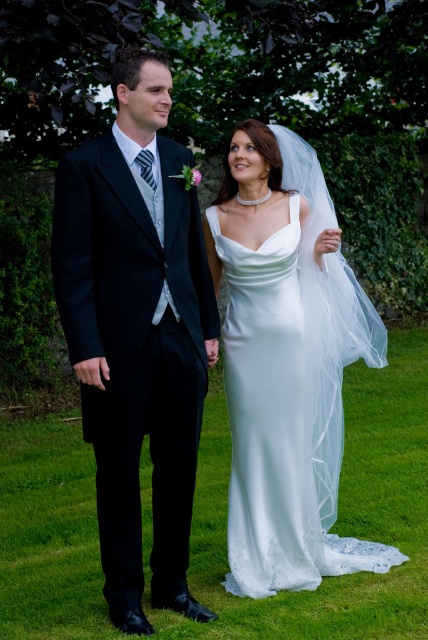
Based on the photo, who is taller, matte black suit at left or green grass at center?

Standing taller between the two is matte black suit at left.

Which is below, matte black suit at left or green grass at center?

green grass at center is below.

Does point (151, 385) lie in front of point (20, 506)?

Yes, it is in front of point (20, 506).

This screenshot has height=640, width=428. I want to click on matte black suit at left, so click(x=136, y=332).

Image resolution: width=428 pixels, height=640 pixels. I want to click on green grass at center, so click(x=225, y=524).

From the picture: Is green grass at center further to the viewer compared to white satin dress at center?

That is True.

Which is behind, point (229, 630) or point (240, 260)?

Positioned behind is point (240, 260).

At what (x,y) coordinates should I click in order to perform the action: click on green grass at center. Please return your answer as a coordinate pair (x, y). This screenshot has height=640, width=428. Looking at the image, I should click on (225, 524).

What do you see at coordinates (136, 332) in the screenshot? The width and height of the screenshot is (428, 640). I see `matte black suit at left` at bounding box center [136, 332].

Between matte black suit at left and white satin dress at center, which one has less height?

With less height is white satin dress at center.

This screenshot has height=640, width=428. What do you see at coordinates (136, 332) in the screenshot? I see `matte black suit at left` at bounding box center [136, 332].

Locate an element on the screen. Image resolution: width=428 pixels, height=640 pixels. matte black suit at left is located at coordinates (136, 332).